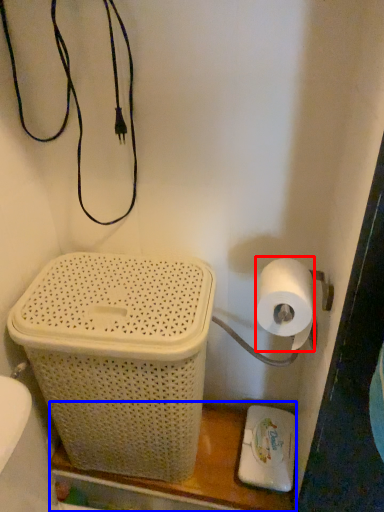
Question: Which of the following is the farthest to the observer, toilet paper (highlighted by a red box) or shelf (highlighted by a blue box)?

Choices:
 (A) toilet paper
 (B) shelf

Answer: (B)